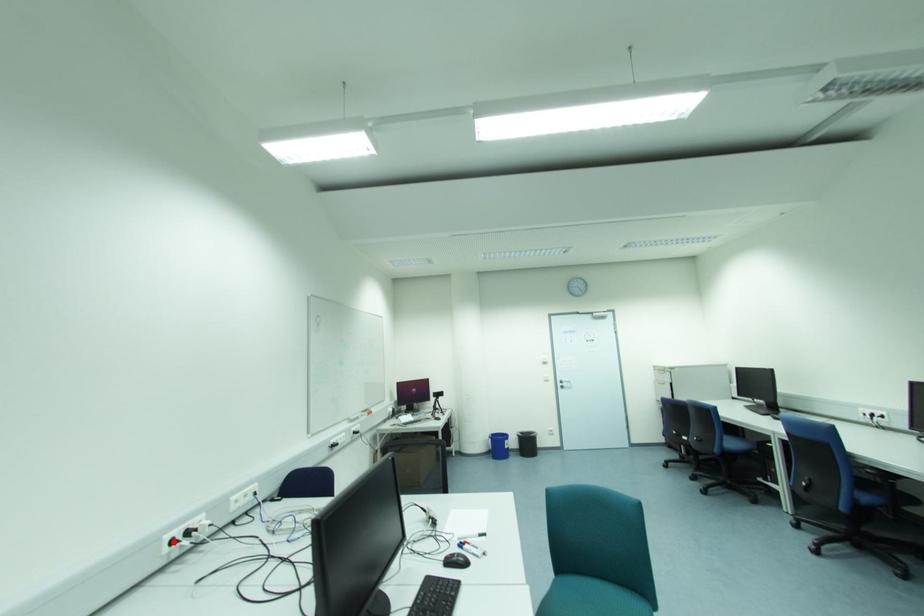
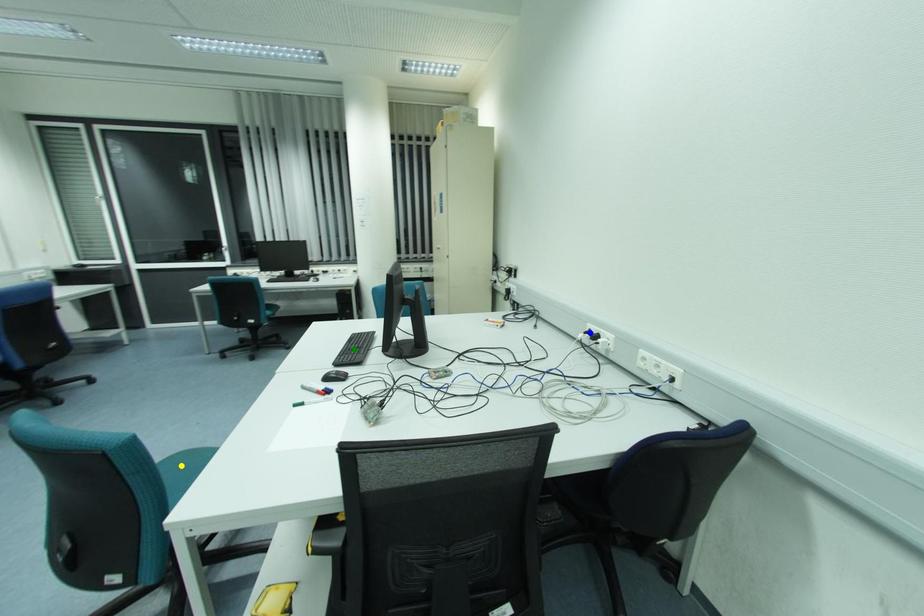
Question: I am providing you with two images of the same scene from different viewpoints. A red point is marked on the first image. You are given multiple points on the second image. Which mark in image 2 goes with the point in image 1?

Choices:
 (A) green point
 (B) blue point
 (C) yellow point

Answer: (B)